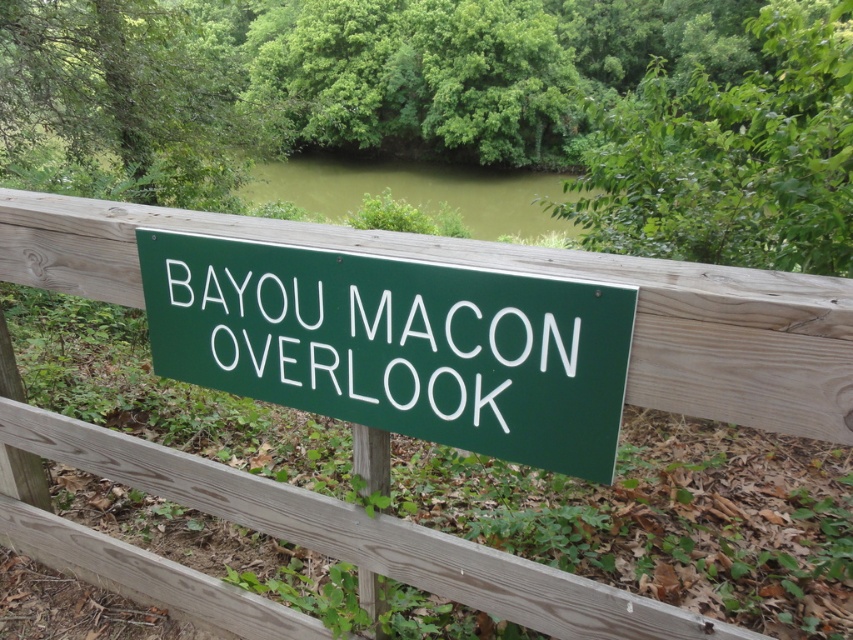
Question: Which of these objects is positioned farthest from the green painted wood sign at center?

Choices:
 (A) green murky water at upper center
 (B) green wood fence at center

Answer: (A)

Question: Is green painted wood sign at center wider than green wood fence at center?

Choices:
 (A) yes
 (B) no

Answer: (B)

Question: Which of the following is the closest to the observer?

Choices:
 (A) green wood fence at center
 (B) green murky water at upper center
 (C) green painted wood sign at center

Answer: (A)

Question: Observing the image, what is the correct spatial positioning of green wood fence at center in reference to green murky water at upper center?

Choices:
 (A) left
 (B) right

Answer: (A)

Question: Which point is closer to the camera?

Choices:
 (A) green painted wood sign at center
 (B) green wood fence at center

Answer: (B)

Question: Is green painted wood sign at center positioned in front of green murky water at upper center?

Choices:
 (A) no
 (B) yes

Answer: (B)